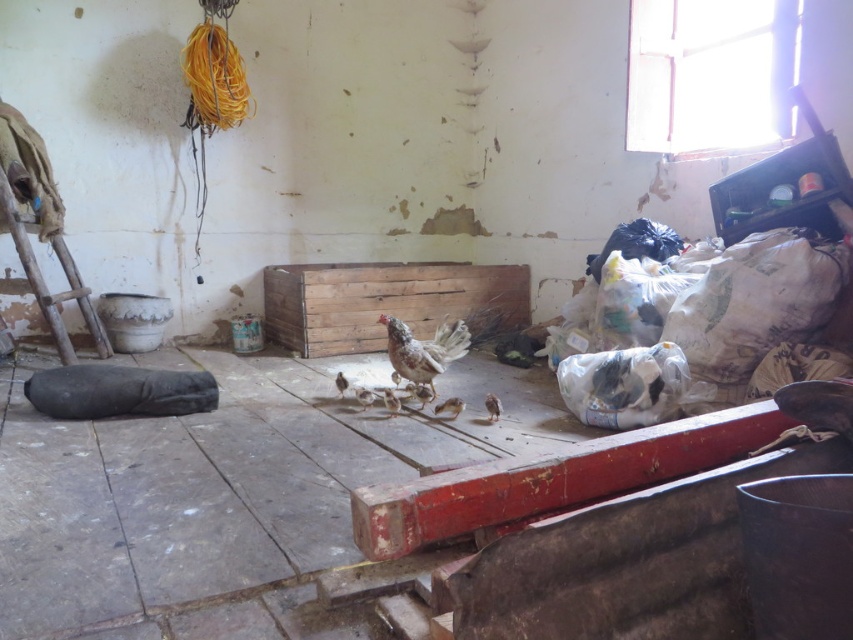
Question: Which point is closer to the camera?

Choices:
 (A) wooden crate at center
 (B) rusty wood ladder at left

Answer: (B)

Question: Is wooden crate at center closer to camera compared to rusty wood ladder at left?

Choices:
 (A) no
 (B) yes

Answer: (A)

Question: Is wooden crate at center below rusty wood ladder at left?

Choices:
 (A) no
 (B) yes

Answer: (A)

Question: Which object is closer to the camera taking this photo?

Choices:
 (A) rusty wood ladder at left
 (B) wooden crate at center

Answer: (A)

Question: Does wooden crate at center appear over rusty wood ladder at left?

Choices:
 (A) yes
 (B) no

Answer: (A)